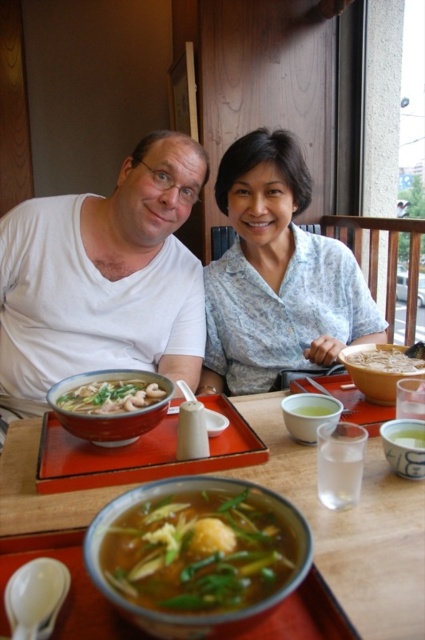
You are a server in a restaurant and need to serve two guests. You have a matte ceramic bowl at center and a white matte bowl at center on the table. Which bowl should you use to serve a main dish that requires more space?

The matte ceramic bowl at center has a larger size compared to the white matte bowl at center, so it is better to use the matte ceramic bowl at center to serve the main dish that requires more space.

Looking at this image, you are a server at the restaurant and need to place a new dish on the table. The dish is slightly larger than the light blue cotton shirt at center. Will it fit without overlapping the green translucent soup at center?

The light blue cotton shirt at center is larger than the green translucent soup at center. Since the new dish is larger than the light blue cotton shirt at center, it will be bigger than the green translucent soup at center. However, without knowing the exact size of the table or the arrangement of existing items, it is uncertain if the dish will fit without overlapping. Consider checking the available space first.

You are a server at the restaurant and need to place a new dish on the table between the light blue cotton shirt at center and the green translucent soup at center. Is there enough space for the dish if it is 15 cm wide?

The light blue cotton shirt at center might be wider than green translucent soup at center, so there may not be enough space between them to place a 15 cm wide dish. Check the actual width before placing the dish.